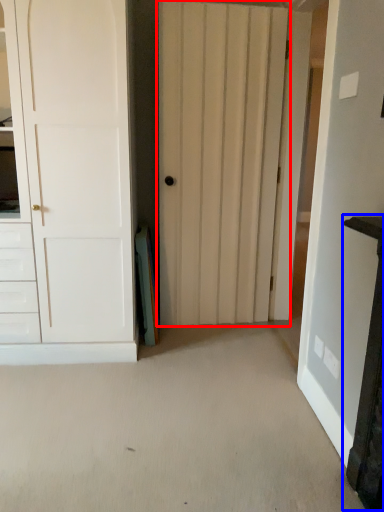
Question: Which object is closer to the camera taking this photo, door (highlighted by a red box) or vanity (highlighted by a blue box)?

Choices:
 (A) door
 (B) vanity

Answer: (B)